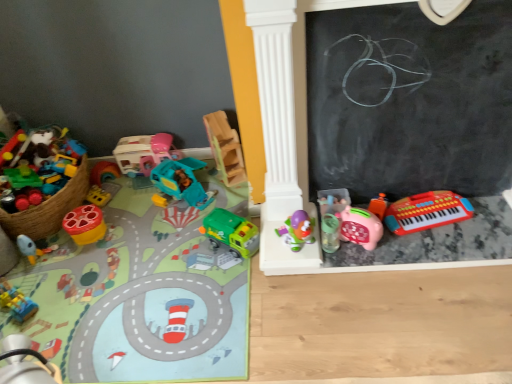
Where is `free space that is to the left of green plastic toy truck at center, placed as the eighth toy when sorted from left to right`? free space that is to the left of green plastic toy truck at center, placed as the eighth toy when sorted from left to right is located at coordinates pyautogui.click(x=195, y=253).